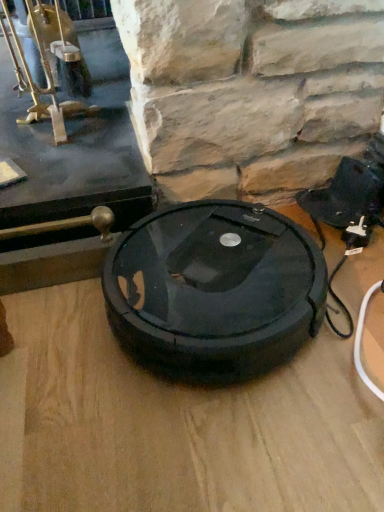
Question: Based on their positions, is black plastic table top at center located to the left or right of black rubber robot vacuum cleaner at center?

Choices:
 (A) right
 (B) left

Answer: (B)

Question: Relative to black rubber robot vacuum cleaner at center, is black plastic table top at center in front or behind?

Choices:
 (A) front
 (B) behind

Answer: (A)

Question: Considering the positions of point (334, 315) and point (145, 261), is point (334, 315) closer or farther from the camera than point (145, 261)?

Choices:
 (A) closer
 (B) farther

Answer: (A)

Question: Is black rubber robot vacuum cleaner at center inside the boundaries of black plastic table top at center, or outside?

Choices:
 (A) inside
 (B) outside

Answer: (B)

Question: Is black rubber robot vacuum cleaner at center to the left or to the right of black plastic table top at center in the image?

Choices:
 (A) right
 (B) left

Answer: (A)

Question: In the image, is black rubber robot vacuum cleaner at center positioned in front of or behind black plastic table top at center?

Choices:
 (A) behind
 (B) front

Answer: (A)

Question: Considering the positions of black rubber robot vacuum cleaner at center and black plastic table top at center in the image, is black rubber robot vacuum cleaner at center wider or thinner than black plastic table top at center?

Choices:
 (A) thin
 (B) wide

Answer: (A)